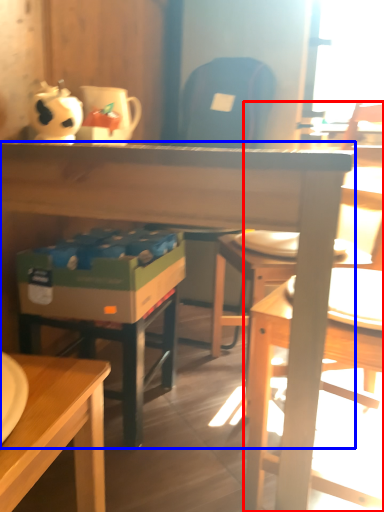
Question: Among these objects, which one is farthest to the camera, chair (highlighted by a red box) or desk (highlighted by a blue box)?

Choices:
 (A) chair
 (B) desk

Answer: (A)